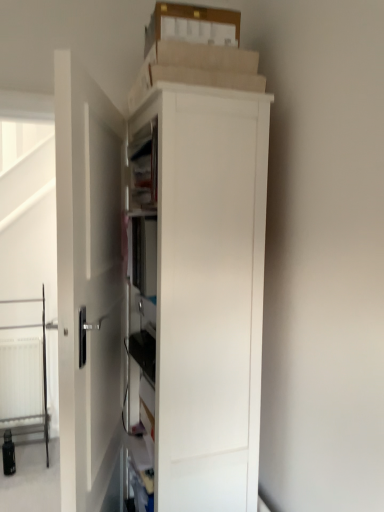
Identify the location of blank space situated above white plastic radiator at lower left (from a real-world perspective). The width and height of the screenshot is (384, 512). (18, 339).